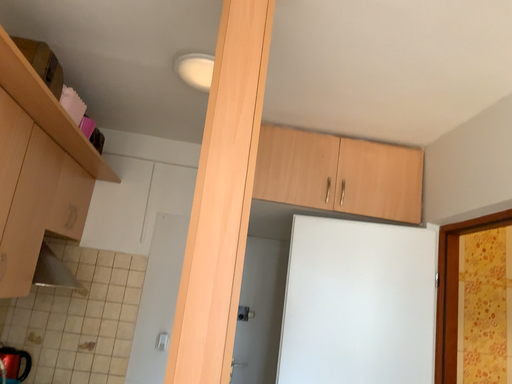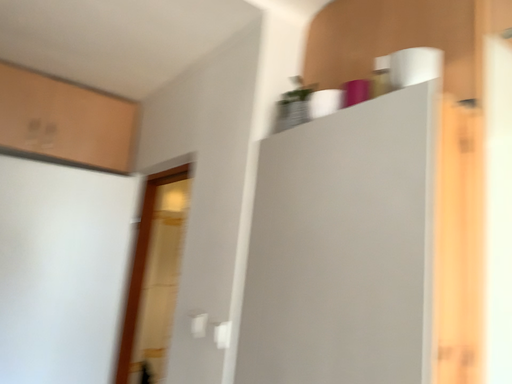
Question: How did the camera likely rotate when shooting the video?

Choices:
 (A) rotated right
 (B) rotated left

Answer: (A)